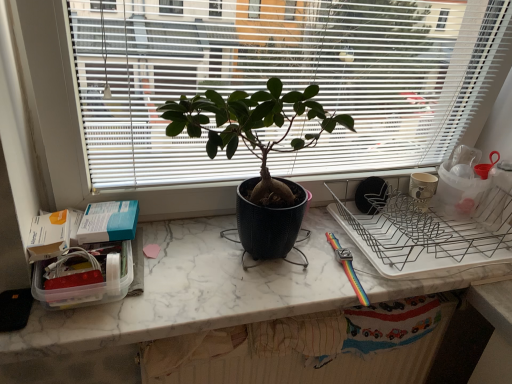
Image resolution: width=512 pixels, height=384 pixels. Find the location of `free space to the left of matte black pot at center`. free space to the left of matte black pot at center is located at coordinates (154, 258).